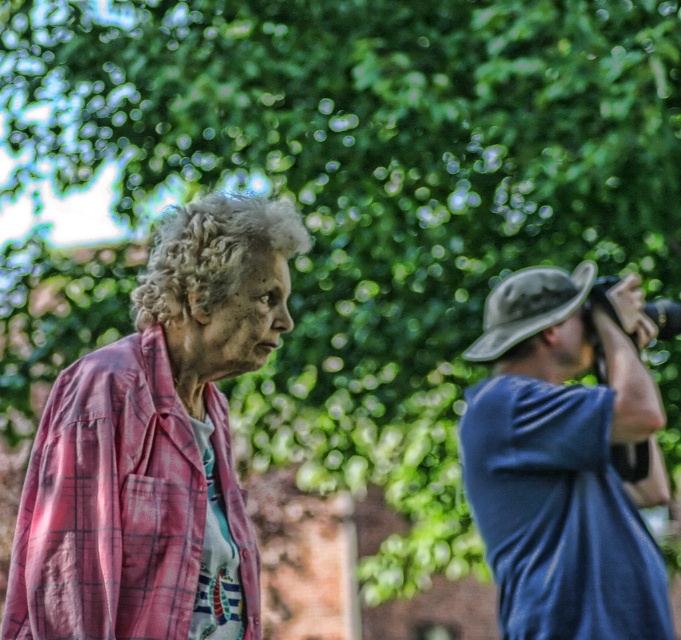
Who is higher up, pink plaid shirt at left or blue fabric hat at upper right?

Positioned higher is pink plaid shirt at left.

Does point (151, 333) lie behind point (620, 342)?

No, it is in front of (620, 342).

Image resolution: width=681 pixels, height=640 pixels. I want to click on pink plaid shirt at left, so click(x=157, y=444).